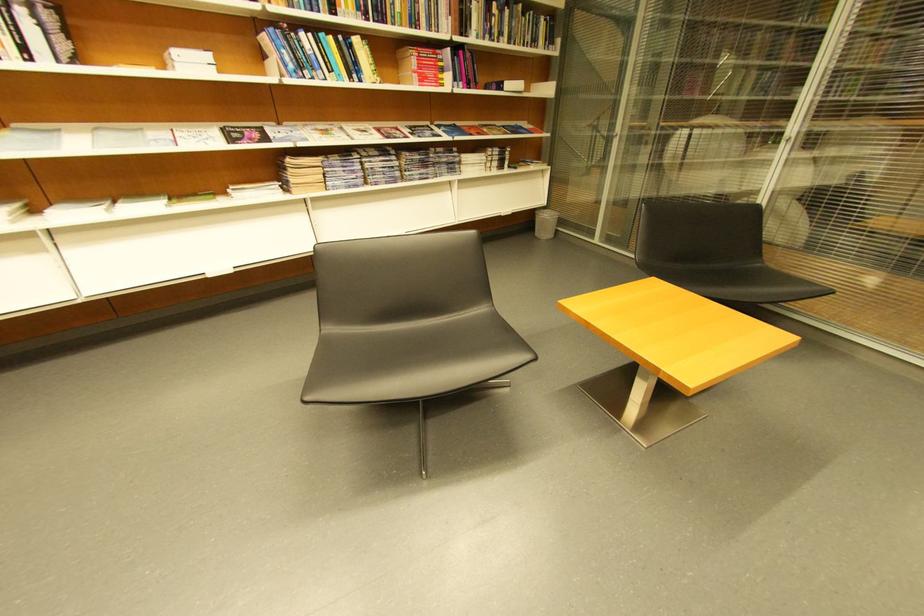
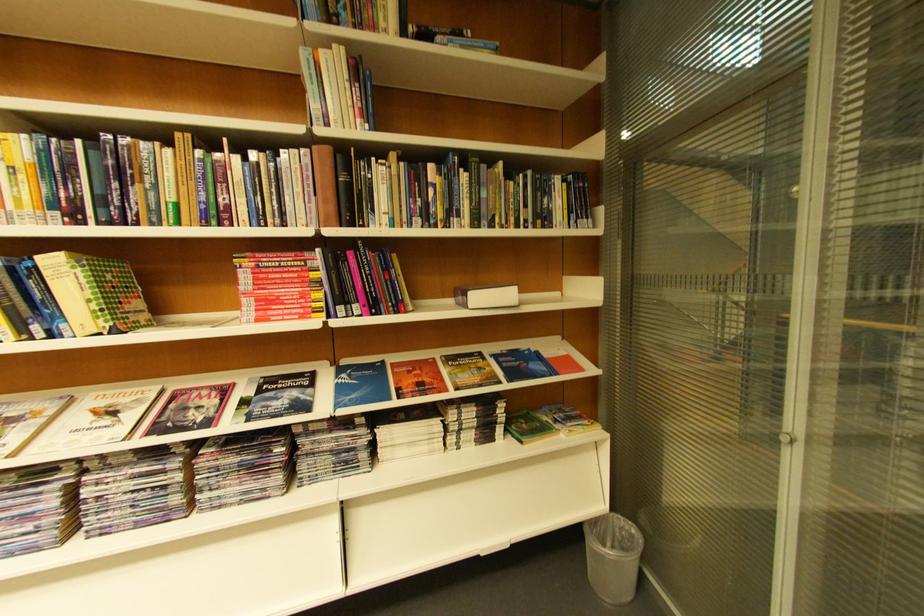
Where in the second image is the point corresponding to [516,91] from the first image?

(480, 309)